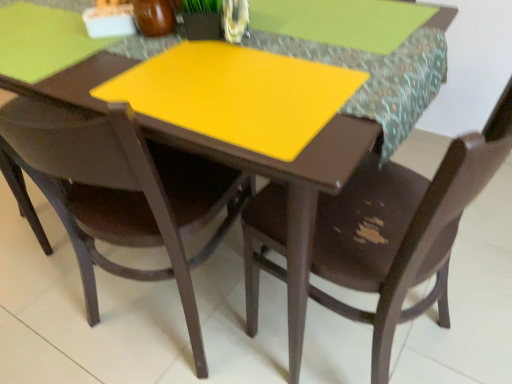
What are the coordinates of `vacant region to the right of brown matte chair at center, acting as the 2th chair starting from the left` in the screenshot? It's located at (473, 310).